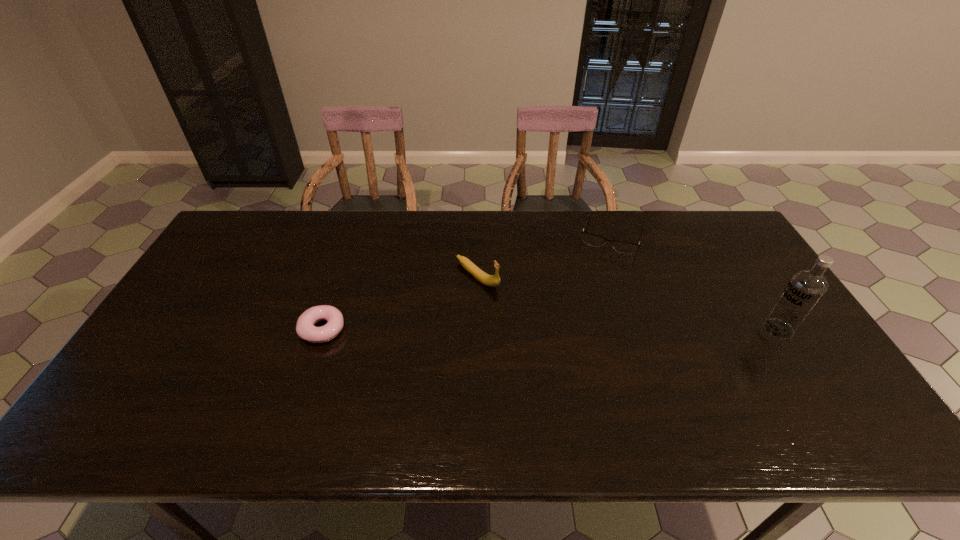
Image resolution: width=960 pixels, height=540 pixels. I want to click on doughnut, so click(305, 329).

This screenshot has width=960, height=540. In order to click on the tallest object in this screenshot , I will do `click(805, 289)`.

Where is `the rightmost object`? The width and height of the screenshot is (960, 540). the rightmost object is located at coordinates (805, 289).

The width and height of the screenshot is (960, 540). Identify the location of the third object from left to right. (594, 240).

You are a GUI agent. You are given a task and a screenshot of the screen. Output one action in this format:
    pyautogui.click(x=<x>, y=<y>)
    Task: Click on the spectacles
    The height and width of the screenshot is (540, 960).
    Given the screenshot: What is the action you would take?
    pyautogui.click(x=594, y=240)

At what (x,y) coordinates should I click in order to perform the action: click on banana. Please return your answer as a coordinate pair (x, y). This screenshot has height=540, width=960. Looking at the image, I should click on (489, 280).

Locate an element on the screen. the third nearest object is located at coordinates point(489,280).

In order to click on free space located on the right of the doughnut in this screenshot , I will do `click(448, 329)`.

Identify the location of free spot located 0.230m on the front label of the vodka. The width and height of the screenshot is (960, 540). pyautogui.click(x=680, y=329).

Where is `vacant space located 0.090m on the front label of the vodka`? This screenshot has height=540, width=960. vacant space located 0.090m on the front label of the vodka is located at coordinates (731, 329).